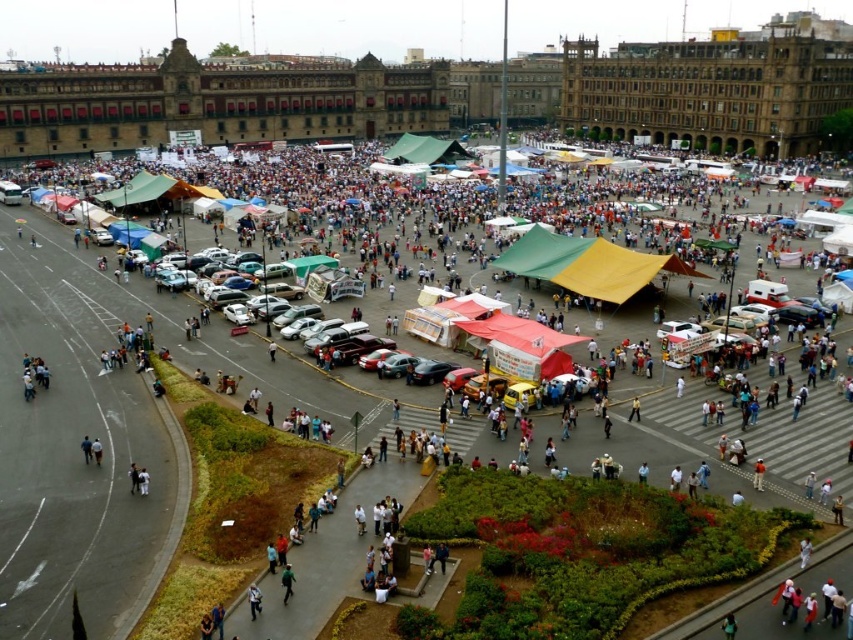
You are standing in the public square and want to move from your current position to a point closer to the historic buildings. Which point should you head towards, point (581, 272) or point (415, 136)?

You should head towards point (415, 136) because it is further away from the viewer, meaning it is closer to the historic buildings surrounding the square.